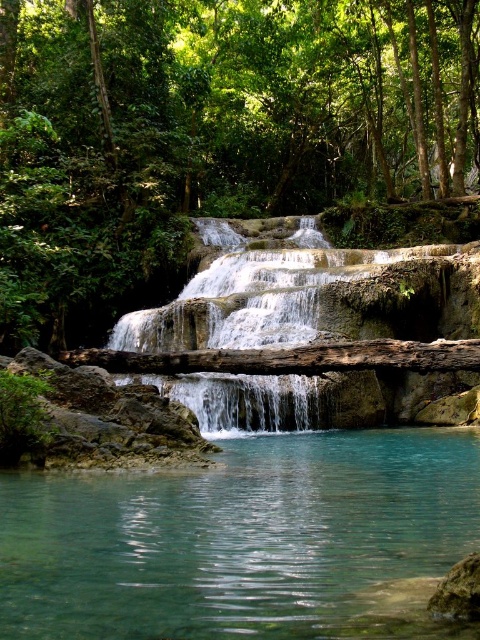
Question: Among these points, which one is nearest to the camera?

Choices:
 (A) (15, 22)
 (B) (212, 401)
 (C) (365, 570)

Answer: (C)

Question: Considering the real-world distances, which object is farthest from the clear water at center?

Choices:
 (A) green leafy tree at center
 (B) clear glass water at center

Answer: (A)

Question: Does green leafy tree at center have a smaller size compared to clear water at center?

Choices:
 (A) no
 (B) yes

Answer: (A)

Question: Is clear glass water at center wider than clear water at center?

Choices:
 (A) yes
 (B) no

Answer: (B)

Question: Among these points, which one is farthest from the camera?

Choices:
 (A) (334, 256)
 (B) (345, 497)

Answer: (A)

Question: Where is green leafy tree at center located in relation to clear glass water at center in the image?

Choices:
 (A) above
 (B) below

Answer: (A)